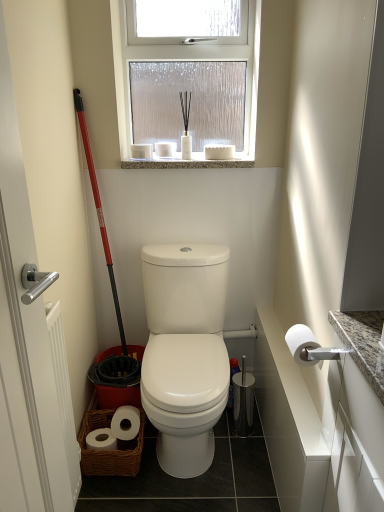
Question: Are white glossy toilet at center and white matte toilet paper at right beside each other?

Choices:
 (A) yes
 (B) no

Answer: (B)

Question: Does white glossy toilet at center have a lesser height compared to white matte toilet paper at right?

Choices:
 (A) yes
 (B) no

Answer: (B)

Question: Is the position of white glossy toilet at center less distant than that of white matte toilet paper at right?

Choices:
 (A) no
 (B) yes

Answer: (A)

Question: Is white glossy toilet at center not close to white matte toilet paper at right?

Choices:
 (A) no
 (B) yes

Answer: (A)

Question: From a real-world perspective, is white glossy toilet at center under white matte toilet paper at right?

Choices:
 (A) yes
 (B) no

Answer: (A)

Question: From the image's perspective, is white matte toilet paper at right above or below white glossy toilet at center?

Choices:
 (A) below
 (B) above

Answer: (B)

Question: Is point (314, 357) closer or farther from the camera than point (223, 313)?

Choices:
 (A) farther
 (B) closer

Answer: (B)

Question: Looking at the image, does white matte toilet paper at right seem bigger or smaller compared to white glossy toilet at center?

Choices:
 (A) small
 (B) big

Answer: (A)

Question: Is white matte toilet paper at right taller or shorter than white glossy toilet at center?

Choices:
 (A) short
 (B) tall

Answer: (A)

Question: Is white glossy toilet at center taller or shorter than white matte toilet paper at right?

Choices:
 (A) short
 (B) tall

Answer: (B)

Question: Based on their positions, is white glossy toilet at center located to the left or right of white matte toilet paper at right?

Choices:
 (A) right
 (B) left

Answer: (B)

Question: Is white glossy toilet at center wider or thinner than white matte toilet paper at right?

Choices:
 (A) thin
 (B) wide

Answer: (B)

Question: From the image's perspective, is white glossy toilet at center positioned above or below white matte toilet paper at right?

Choices:
 (A) above
 (B) below

Answer: (B)

Question: From a real-world perspective, is frosted glass window at upper center above or below white matte toilet paper at right?

Choices:
 (A) below
 (B) above

Answer: (B)

Question: Looking at their shapes, would you say frosted glass window at upper center is wider or thinner than white matte toilet paper at right?

Choices:
 (A) thin
 (B) wide

Answer: (A)